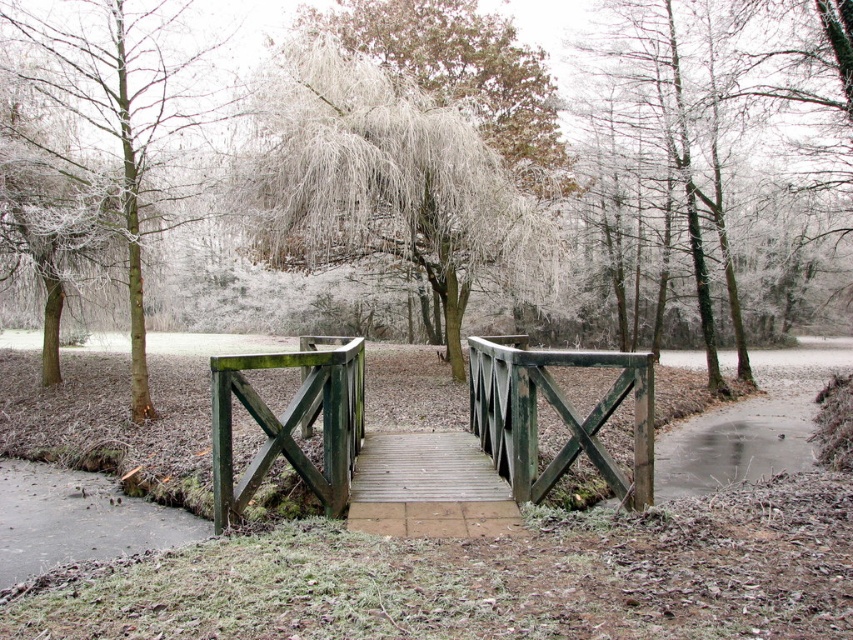
You are a hiker who wants to cross the frozen lake. You see two bridges in the scene, the green wood bridge at center and the wooden bridge at center. Which bridge is larger in size?

The wooden bridge at center is larger than the green wood bridge at center.

Consider the image. You are standing at the point with coordinates [428,438] in the winter scene. What structure are you currently on?

The point with coordinates [428,438] is on the green wood bridge at center, so you are currently on the green wood bridge at center.